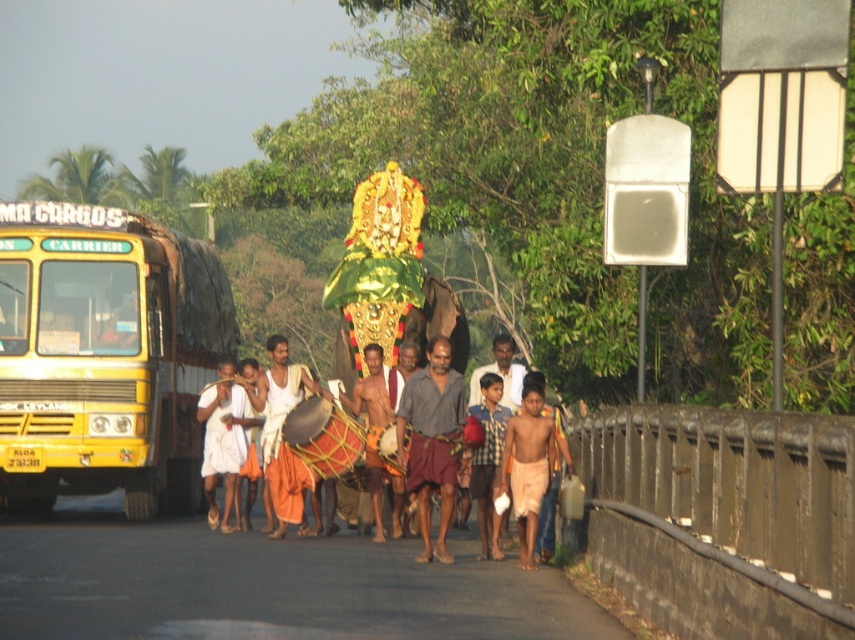
Question: Based on their relative distances, which object is farther from the yellow matte school bus at left?

Choices:
 (A) gray cotton shirt at center
 (B) orange cloth at center
 (C) shiny golden drum at center
 (D) white cotton cloth at center

Answer: (A)

Question: Which of the following is the closest to the observer?

Choices:
 (A) [481, 534]
 (B) [378, 456]
 (C) [540, 442]

Answer: (C)

Question: Can you confirm if yellow matte school bus at left is positioned to the left of shiny golden drum at center?

Choices:
 (A) no
 (B) yes

Answer: (B)

Question: Which point appears farthest from the camera in this image?

Choices:
 (A) (517, 502)
 (B) (494, 468)
 (C) (441, 403)
 (D) (296, 456)

Answer: (D)

Question: Does yellow matte school bus at left have a lesser width compared to light orange cotton dhoti at center?

Choices:
 (A) yes
 (B) no

Answer: (A)

Question: From the image, what is the correct spatial relationship of orange cloth at center in relation to shiny golden drum at center?

Choices:
 (A) left
 (B) right

Answer: (A)